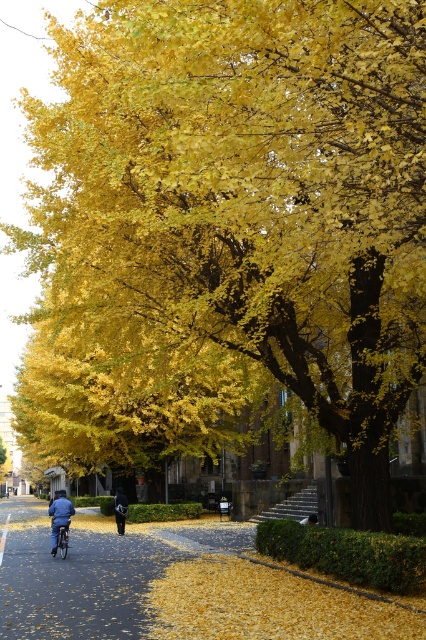
Question: Which point is farther from the camera taking this photo?

Choices:
 (A) (117, 529)
 (B) (63, 554)

Answer: (A)

Question: Which of the following is the closest to the observer?

Choices:
 (A) (58, 541)
 (B) (123, 525)

Answer: (A)

Question: Can you confirm if metallic silver bicycle at center is bigger than dark blue fabric jacket at center?

Choices:
 (A) yes
 (B) no

Answer: (B)

Question: Which point is closer to the camera?

Choices:
 (A) (118, 531)
 (B) (63, 518)

Answer: (B)

Question: Can you confirm if metallic silver bicycle at center is positioned above dark blue fabric jacket at center?

Choices:
 (A) no
 (B) yes

Answer: (B)

Question: Is metallic silver bicycle at center positioned in front of dark blue fabric jacket at center?

Choices:
 (A) no
 (B) yes

Answer: (B)